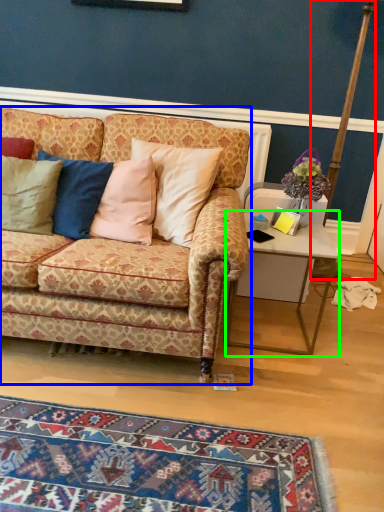
Question: Considering the real-world distances, which object is closest to pole (highlighted by a red box)? studio couch (highlighted by a blue box) or desk (highlighted by a green box).

Choices:
 (A) studio couch
 (B) desk

Answer: (B)